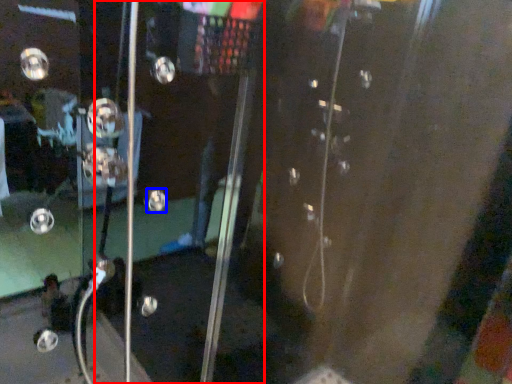
Question: Which object appears closest to the camera in this image, screen door (highlighted by a red box) or knob (highlighted by a blue box)?

Choices:
 (A) screen door
 (B) knob

Answer: (A)